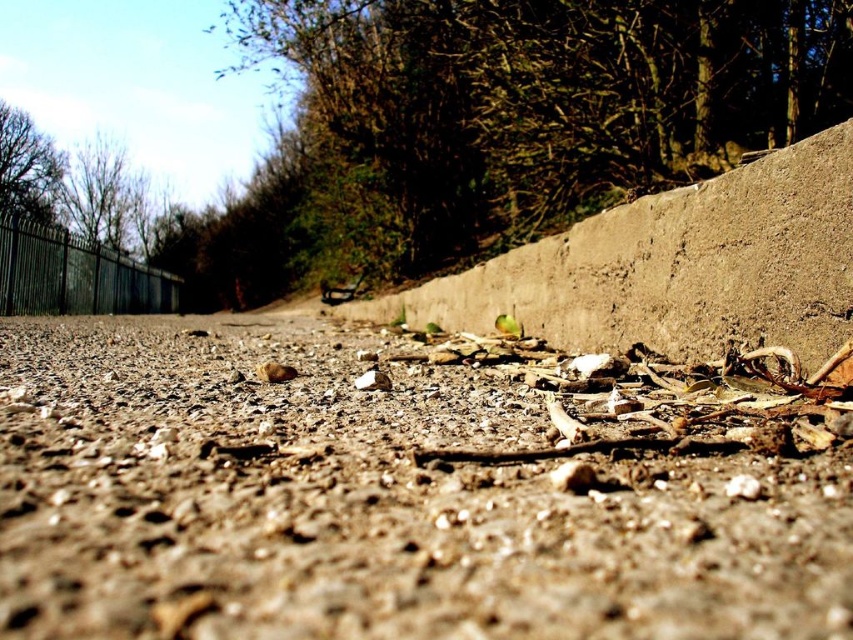
Question: Estimate the real-world distances between objects in this image. Which object is farther from the black metal fence at left?

Choices:
 (A) brown gravel at center
 (B) gray concrete wall at center

Answer: (A)

Question: Is brown gravel at center further to the viewer compared to black metal fence at left?

Choices:
 (A) yes
 (B) no

Answer: (B)

Question: Does gray concrete wall at center have a lesser width compared to black metal fence at left?

Choices:
 (A) no
 (B) yes

Answer: (B)

Question: Among these points, which one is nearest to the camera?

Choices:
 (A) (691, 596)
 (B) (699, 200)

Answer: (A)

Question: Does brown gravel at center have a greater width compared to gray concrete wall at center?

Choices:
 (A) no
 (B) yes

Answer: (B)

Question: Which object is positioned closest to the brown gravel at center?

Choices:
 (A) black metal fence at left
 (B) gray concrete wall at center

Answer: (B)